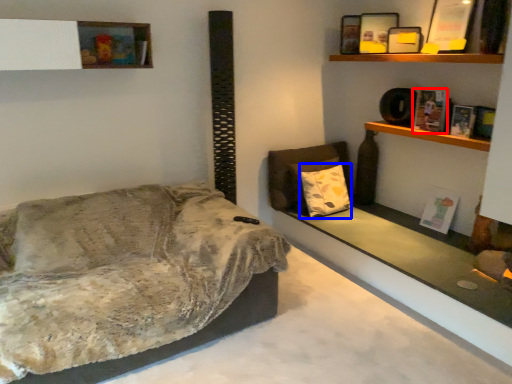
Question: Which object appears closest to the camera in this image, book (highlighted by a red box) or pillow (highlighted by a blue box)?

Choices:
 (A) book
 (B) pillow

Answer: (A)